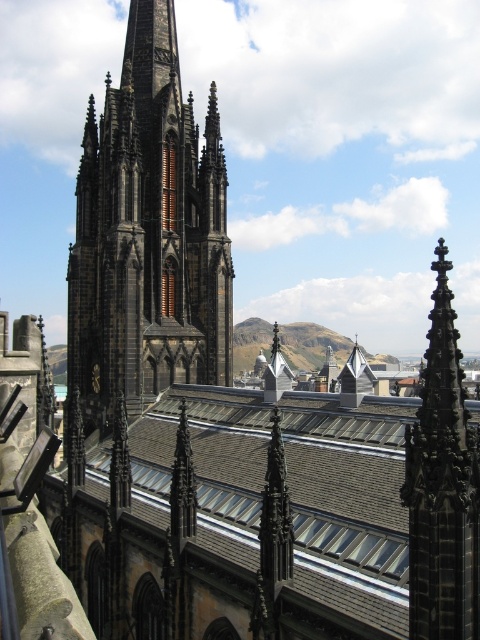
Question: Can you confirm if brown tile roof at center is wider than dark gray stone tower at center?

Choices:
 (A) yes
 (B) no

Answer: (A)

Question: Does brown tile roof at center have a larger size compared to dark gray stone tower at center?

Choices:
 (A) yes
 (B) no

Answer: (A)

Question: Is brown tile roof at center smaller than dark gray stone tower at center?

Choices:
 (A) no
 (B) yes

Answer: (A)

Question: Which object appears closest to the camera in this image?

Choices:
 (A) brown tile roof at center
 (B) dark gray stone tower at center

Answer: (A)

Question: Among these points, which one is farthest from the camera?

Choices:
 (A) (342, 556)
 (B) (176, 44)

Answer: (B)